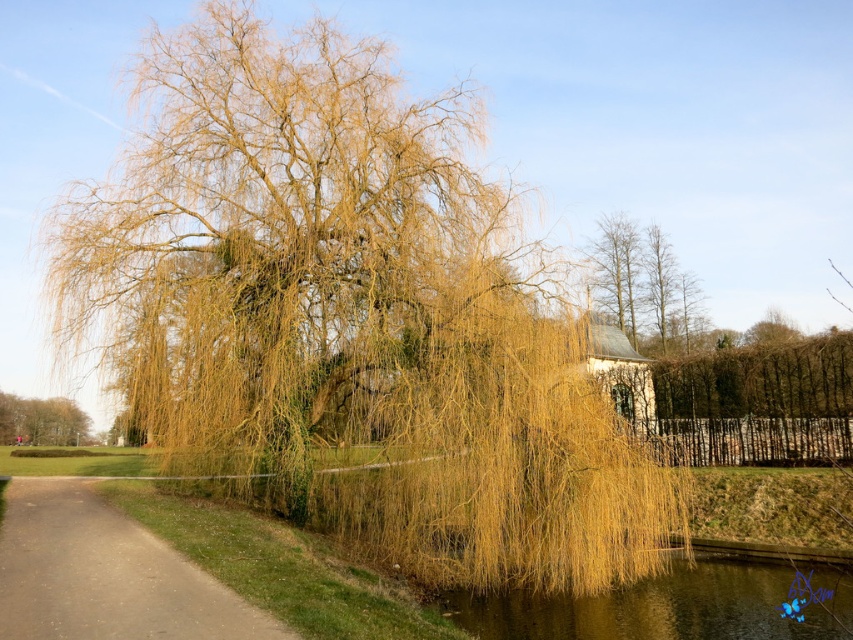
Is yellow-green textured willow at center to the right of golden textured willow at lower left from the viewer's perspective?

Indeed, yellow-green textured willow at center is positioned on the right side of golden textured willow at lower left.

Can you confirm if yellow-green textured willow at center is shorter than golden textured willow at lower left?

In fact, yellow-green textured willow at center may be taller than golden textured willow at lower left.

Does point (421, 468) come closer to viewer compared to point (33, 433)?

Yes, point (421, 468) is in front of point (33, 433).

This screenshot has height=640, width=853. In order to click on yellow-green textured willow at center in this screenshot , I will do `click(350, 316)`.

Is point (827, 620) positioned behind point (57, 426)?

That is False.

Does shiny dark water at lower center appear over golden textured willow at lower left?

Correct, shiny dark water at lower center is located above golden textured willow at lower left.

Is point (840, 609) positioned behind point (57, 444)?

No, (840, 609) is closer to viewer.

This screenshot has width=853, height=640. In order to click on shiny dark water at lower center in this screenshot , I will do `click(677, 600)`.

Does yellow-green textured willow at center have a lesser width compared to shiny dark water at lower center?

In fact, yellow-green textured willow at center might be wider than shiny dark water at lower center.

Who is more forward, (x=103, y=253) or (x=798, y=636)?

Point (x=798, y=636) is in front.

Locate an element on the screen. The width and height of the screenshot is (853, 640). yellow-green textured willow at center is located at coordinates (350, 316).